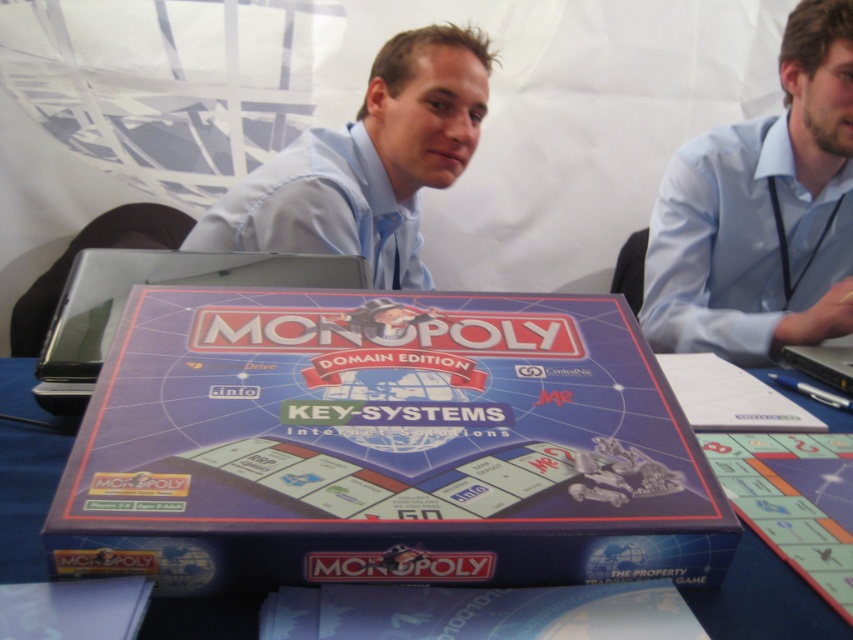
Question: Does light blue shirt at center come behind silver metallic laptop at center?

Choices:
 (A) no
 (B) yes

Answer: (B)

Question: Can you confirm if blue shirt at upper right is positioned to the left of silver metallic laptop at center?

Choices:
 (A) yes
 (B) no

Answer: (B)

Question: Based on their relative distances, which object is nearer to the light blue shirt at center?

Choices:
 (A) blue shirt at upper right
 (B) blue cardboard monopoly box at center

Answer: (A)

Question: Estimate the real-world distances between objects in this image. Which object is closer to the silver metallic laptop at center?

Choices:
 (A) light blue shirt at center
 (B) blue cardboard monopoly box at center
 (C) blue shirt at upper right

Answer: (B)

Question: Can you confirm if light blue shirt at center is thinner than silver metallic laptop at center?

Choices:
 (A) no
 (B) yes

Answer: (A)

Question: Which of the following is the farthest from the observer?

Choices:
 (A) (820, 118)
 (B) (68, 353)
 (C) (297, 140)

Answer: (C)